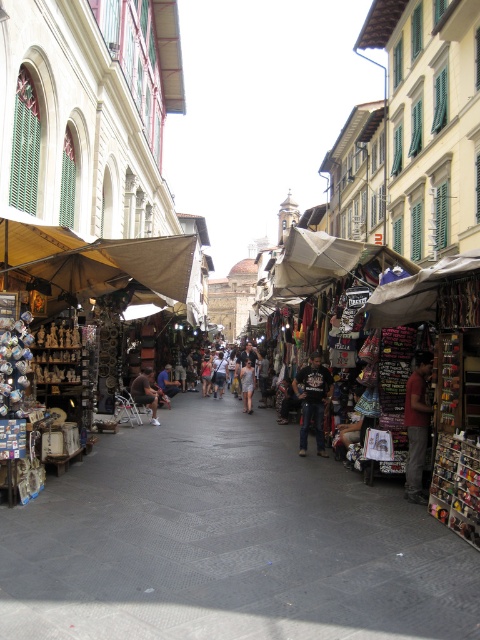
Question: Can you confirm if brown leather bag at center is positioned to the left of light gray fabric dress at center?

Choices:
 (A) no
 (B) yes

Answer: (B)

Question: Which of the following is the closest to the observer?

Choices:
 (A) (316, 408)
 (B) (245, 390)
 (C) (143, 371)

Answer: (A)

Question: Is black cotton shirt at center thinner than dark brown leather jacket at center?

Choices:
 (A) yes
 (B) no

Answer: (B)

Question: Among these objects, which one is farthest from the camera?

Choices:
 (A) dark brown leather jacket at center
 (B) black cotton shirt at center

Answer: (A)

Question: Which point appears closest to the camera in this image?

Choices:
 (A) (323, 442)
 (B) (417, 432)
 (C) (142, 396)
 (D) (166, 365)

Answer: (B)

Question: From the image, what is the correct spatial relationship of smooth gray pavement at center in relation to dark brown leather jacket at center?

Choices:
 (A) right
 (B) left

Answer: (A)